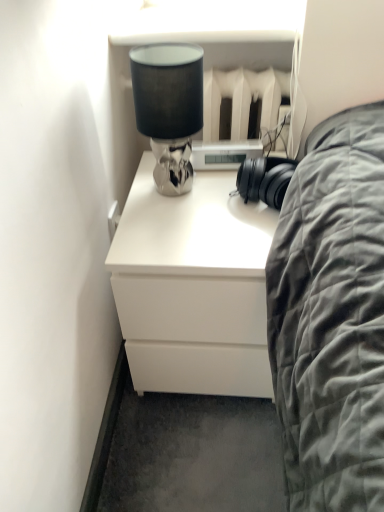
In order to click on free spot in front of satin silver lamp at upper center in this screenshot , I will do `click(180, 226)`.